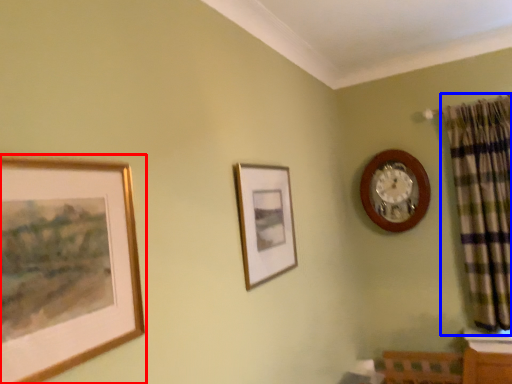
Question: Which of the following is the farthest to the observer, picture frame (highlighted by a red box) or curtain (highlighted by a blue box)?

Choices:
 (A) picture frame
 (B) curtain

Answer: (B)